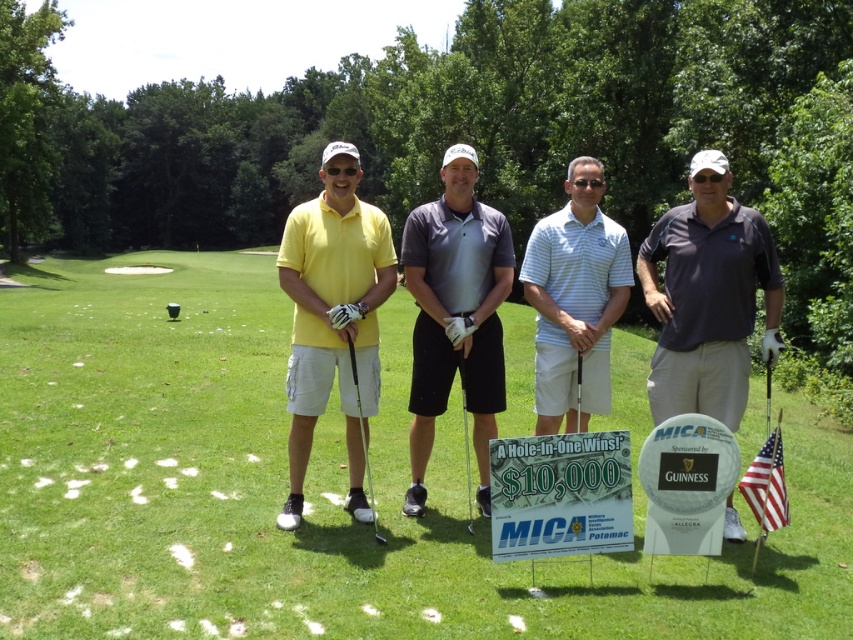
Does green grass at center have a lesser height compared to matte black golf club at center?

No, green grass at center is not shorter than matte black golf club at center.

Between point (344, 531) and point (366, 454), which one is positioned in front?

Point (366, 454) is in front.

Is point (775, 564) more distant than point (364, 465)?

That is False.

At what (x,y) coordinates should I click in order to perform the action: click on green grass at center. Please return your answer as a coordinate pair (x, y). The image size is (853, 640). Looking at the image, I should click on (321, 486).

Who is more forward, (550, 308) or (463, 376)?

Positioned in front is point (550, 308).

This screenshot has width=853, height=640. I want to click on light blue striped polo shirt at center, so click(x=575, y=298).

Between point (433, 512) and point (370, 253), which one is positioned in front?

Point (370, 253)

Does green grass at center appear on the left side of matte yellow shirt at center?

Correct, you'll find green grass at center to the left of matte yellow shirt at center.

The image size is (853, 640). I want to click on green grass at center, so click(321, 486).

In order to click on green grass at center in this screenshot , I will do `click(321, 486)`.